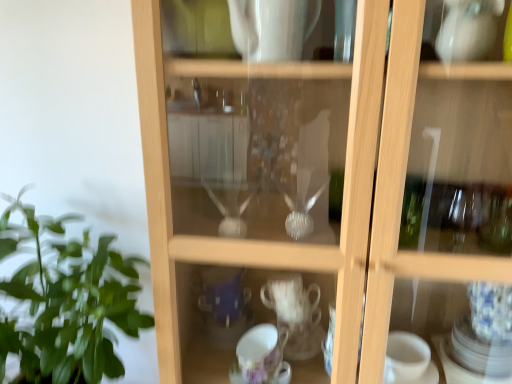
Question: Is green leafy plant at left taller than transparent glass cup at center?

Choices:
 (A) yes
 (B) no

Answer: (B)

Question: Is green leafy plant at left facing away from transparent glass cup at center?

Choices:
 (A) no
 (B) yes

Answer: (A)

Question: Is green leafy plant at left in front of transparent glass cup at center?

Choices:
 (A) yes
 (B) no

Answer: (B)

Question: Considering the relative sizes of green leafy plant at left and transparent glass cup at center in the image provided, is green leafy plant at left bigger than transparent glass cup at center?

Choices:
 (A) yes
 (B) no

Answer: (B)

Question: Is green leafy plant at left not within transparent glass cup at center?

Choices:
 (A) yes
 (B) no

Answer: (A)

Question: Is green leafy plant at left facing towards transparent glass cup at center?

Choices:
 (A) no
 (B) yes

Answer: (A)

Question: From a real-world perspective, is transparent glass cup at center on green leafy plant at left?

Choices:
 (A) no
 (B) yes

Answer: (B)

Question: Is transparent glass cup at center in front of green leafy plant at left?

Choices:
 (A) no
 (B) yes

Answer: (B)

Question: Could you tell me if transparent glass cup at center is turned towards green leafy plant at left?

Choices:
 (A) yes
 (B) no

Answer: (B)

Question: Can you confirm if transparent glass cup at center is smaller than green leafy plant at left?

Choices:
 (A) yes
 (B) no

Answer: (B)

Question: Is transparent glass cup at center looking in the opposite direction of green leafy plant at left?

Choices:
 (A) no
 (B) yes

Answer: (A)

Question: Is transparent glass cup at center touching green leafy plant at left?

Choices:
 (A) no
 (B) yes

Answer: (A)

Question: From the image's perspective, relative to green leafy plant at left, is transparent glass cup at center above or below?

Choices:
 (A) above
 (B) below

Answer: (A)